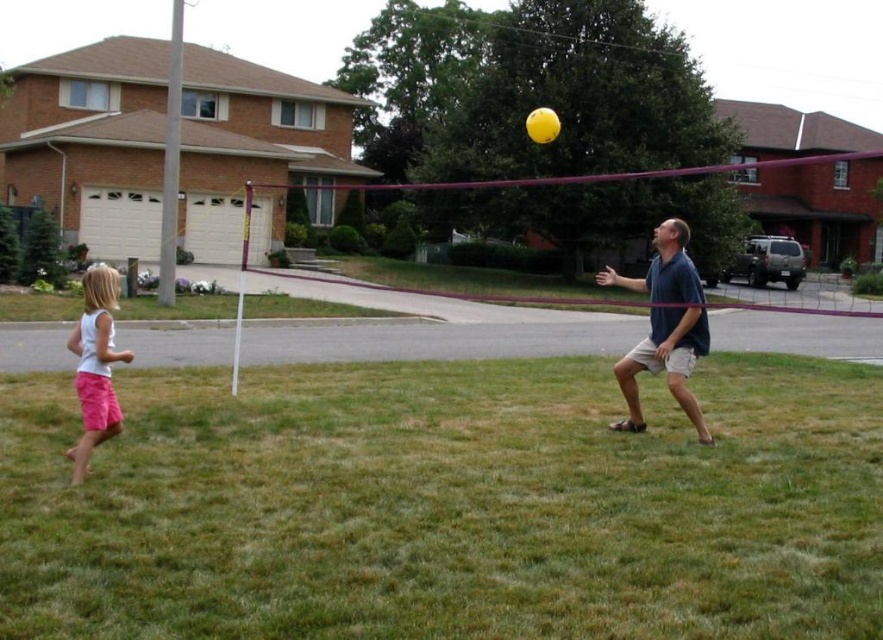
Does point (91, 304) come in front of point (544, 129)?

That is True.

Locate an element on the screen. white cotton shirt at lower left is located at coordinates (95, 364).

Which is in front, point (93, 353) or point (537, 136)?

Point (93, 353)

You are a GUI agent. You are given a task and a screenshot of the screen. Output one action in this format:
    pyautogui.click(x=<x>, y=<y>)
    Task: Click on the white cotton shirt at lower left
    Image resolution: width=883 pixels, height=640 pixels.
    Given the screenshot: What is the action you would take?
    pyautogui.click(x=95, y=364)

At what (x,y) coordinates should I click in order to perform the action: click on blue cotton shirt at right. Please return your answer as a coordinate pair (x, y). Looking at the image, I should click on (665, 364).

Who is lower down, blue cotton shirt at right or white cotton shirt at lower left?

white cotton shirt at lower left

What do you see at coordinates (665, 364) in the screenshot? This screenshot has width=883, height=640. I see `blue cotton shirt at right` at bounding box center [665, 364].

Identify the location of blue cotton shirt at right. The image size is (883, 640). (665, 364).

Between point (580, 616) and point (109, 384), which one is positioned in front?

Point (580, 616) is more forward.

Where is `green grass at center`? green grass at center is located at coordinates (448, 506).